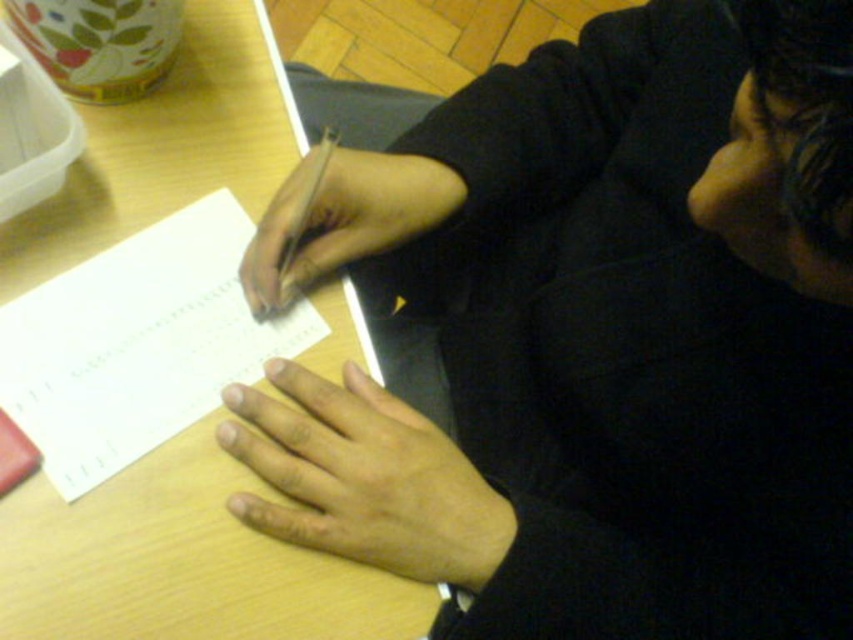
Between point (141, 360) and point (289, 282), which one is positioned in front?

Positioned in front is point (141, 360).

Is white paper notebook at left wider than smooth skin hand at center?

Yes.

At what (x,y) coordinates should I click in order to perform the action: click on white paper notebook at left. Please return your answer as a coordinate pair (x, y). Looking at the image, I should click on (138, 342).

Is point (711, 465) less distant than point (259, 275)?

Yes, it is.

Is dark matte hand at center positioned before smooth skin hand at center?

That is True.

The image size is (853, 640). In order to click on dark matte hand at center in this screenshot , I will do `click(595, 337)`.

Is wooden table at center thinner than smooth skin hand at center?

No.

Is wooden table at center closer to the viewer compared to smooth skin hand at center?

Yes, it is in front of smooth skin hand at center.

Who is more distant from viewer, (x=82, y=218) or (x=341, y=147)?

Positioned behind is point (x=341, y=147).

Locate an element on the screen. The height and width of the screenshot is (640, 853). wooden table at center is located at coordinates (181, 563).